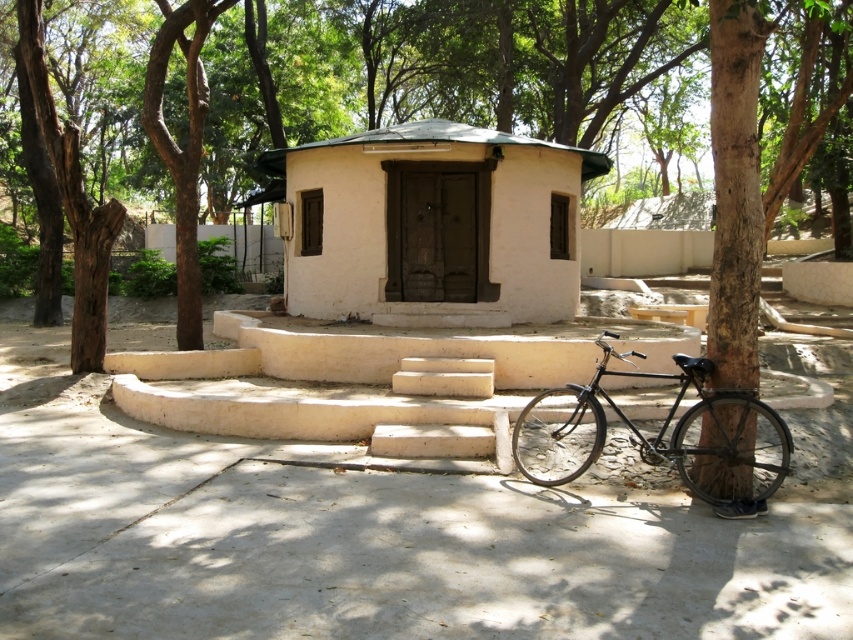
Question: Where is white matte/hardobject at center located in relation to shiny black bicycle at lower right in the image?

Choices:
 (A) below
 (B) above

Answer: (B)

Question: Can you confirm if white matte/hardobject at center is positioned to the right of shiny black bicycle at lower right?

Choices:
 (A) no
 (B) yes

Answer: (A)

Question: Which point appears farthest from the camera in this image?

Choices:
 (A) (318, 260)
 (B) (747, 500)

Answer: (A)

Question: Is white matte/hardobject at center above shiny black bicycle at lower right?

Choices:
 (A) yes
 (B) no

Answer: (A)

Question: Which point appears farthest from the camera in this image?

Choices:
 (A) (549, 404)
 (B) (541, 280)

Answer: (B)